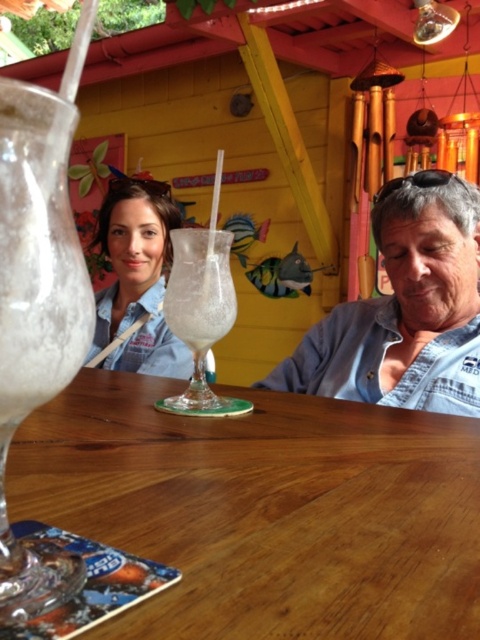
Is point (252, 424) more distant than point (104, 305)?

No, it is not.

Is wooden table at center positioned before matte blue shirt at upper left?

Yes, wooden table at center is closer to the viewer.

You are a GUI agent. You are given a task and a screenshot of the screen. Output one action in this format:
    pyautogui.click(x=<x>, y=<y>)
    Task: Click on the wooden table at center
    Image resolution: width=480 pixels, height=640 pixels.
    Given the screenshot: What is the action you would take?
    pyautogui.click(x=264, y=509)

Is wooden table at center wider than denim shirt at right?

Yes, wooden table at center is wider than denim shirt at right.

Measure the distance between wooden table at center and denim shirt at right.

A distance of 17.05 inches exists between wooden table at center and denim shirt at right.

Does point (56, 486) lie behind point (349, 349)?

No, (56, 486) is closer to viewer.

The image size is (480, 640). I want to click on wooden table at center, so click(264, 509).

Does clear glass cocktail at left have a smaller size compared to matte blue shirt at upper left?

Yes.

In order to click on clear glass cocktail at left in this screenshot , I will do `click(36, 314)`.

Identify the location of clear glass cocktail at left. (36, 314).